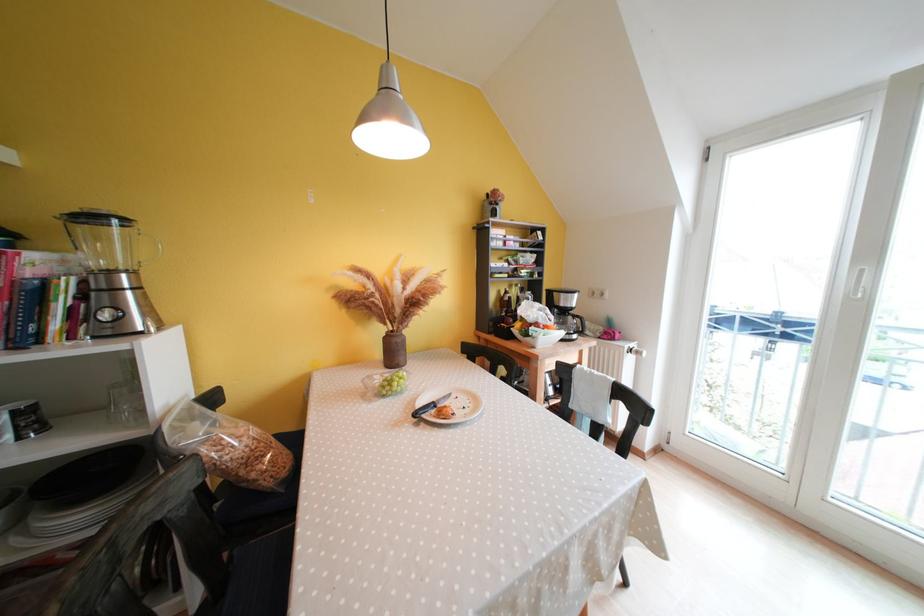
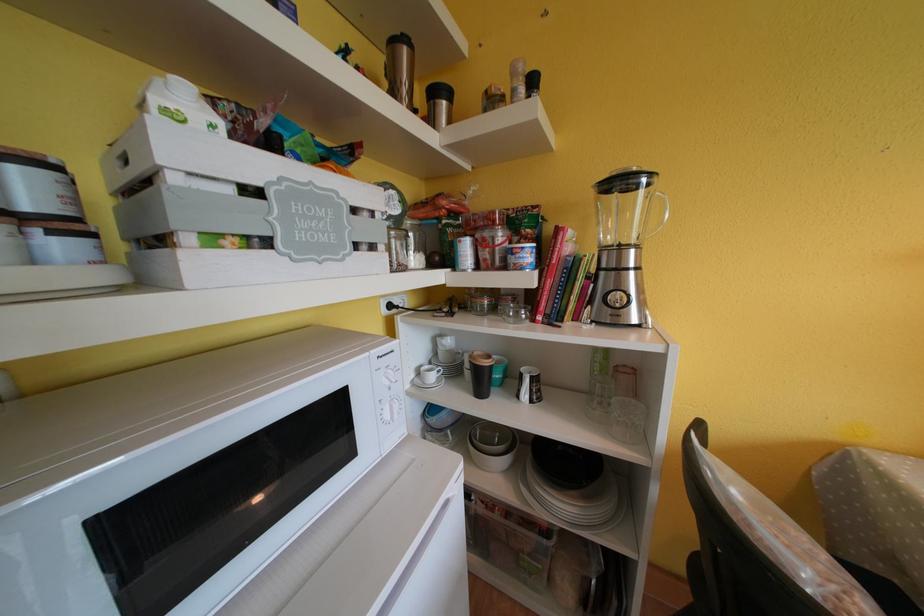
In the second image, find the point that corresponds to pixel 129 280 in the first image.

(638, 254)